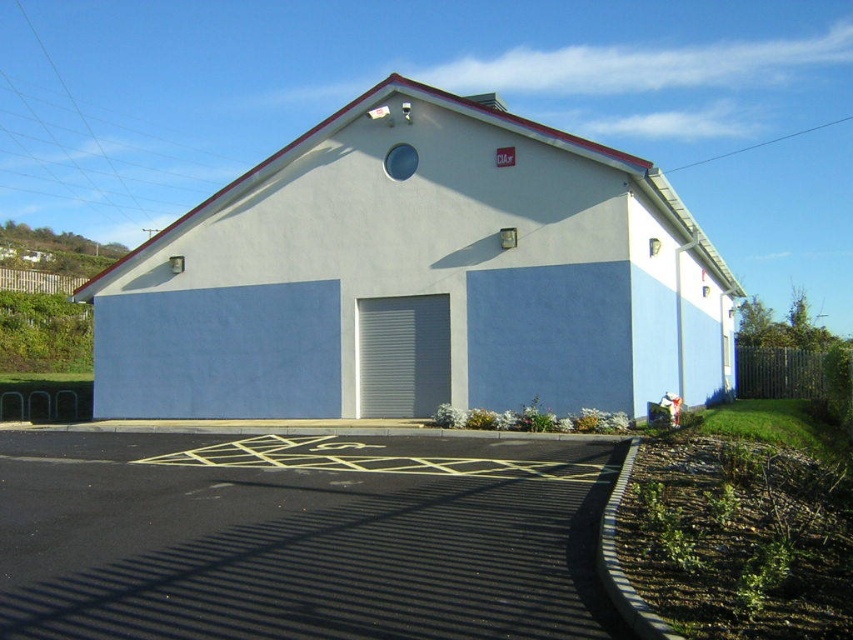
You are a delivery person trying to park your van in front of the building. The parking space has a designated area marked with yellow lines. Which garage door should you align your van with to ensure proper parking? Is it the white matte garage door at center or the gray metallic garage door at center?

The white matte garage door at center is below the gray metallic garage door at center. Therefore, you should align your van with the white matte garage door at center since it is the lower one positioned at the front of the building, which is likely the entrance for vehicles.